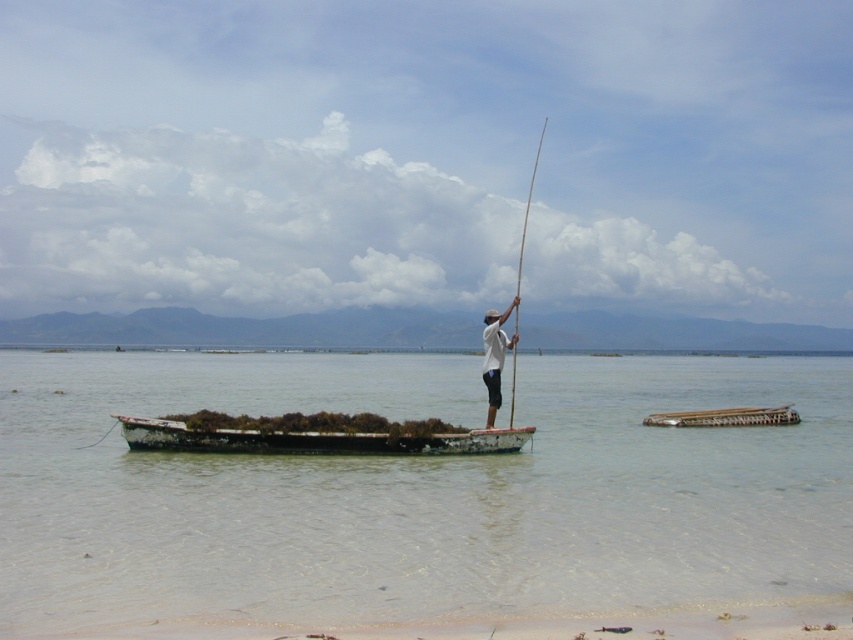
Question: Considering the real-world distances, which object is closest to the white cotton shirt at center?

Choices:
 (A) rusty metal boat at center
 (B) brown wooden raft at center
 (C) clear water at boat center

Answer: (A)

Question: Can you confirm if sandy beach at lower center is smaller than white cotton shirt at center?

Choices:
 (A) yes
 (B) no

Answer: (A)

Question: Which point is closer to the camera?

Choices:
 (A) smooth bamboo pole at center
 (B) sandy beach at lower center
 (C) rusty metal boat at center

Answer: (B)

Question: Which point appears closest to the camera in this image?

Choices:
 (A) (531, 179)
 (B) (685, 420)
 (C) (532, 429)

Answer: (C)

Question: Is rusty metal boat at center further to the viewer compared to brown wooden raft at center?

Choices:
 (A) yes
 (B) no

Answer: (B)

Question: In this image, where is clear water at boat center located relative to sandy beach at lower center?

Choices:
 (A) below
 (B) above

Answer: (B)